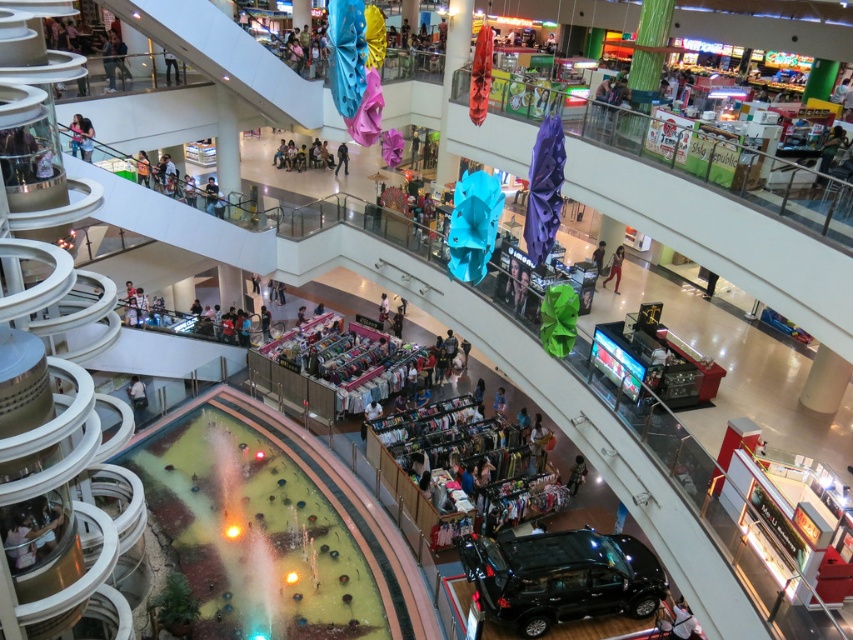
You are a shopper standing at the entrance of the mall and see the matte black clothing at center and the white fabric person at lower left. Which object is positioned to the right side from your viewpoint?

The matte black clothing at center is positioned to the right of the white fabric person at lower left.

You are a shopper who wants to take a photo of both the translucent glass fountain at center and the skinny jeans at center from the second level. Can you fit both in your camera frame if the fountain is wider than the jeans?

The translucent glass fountain at center is wider than the skinny jeans at center, so if you position yourself appropriately on the second level, you can likely capture both in your camera frame as long as the distance allows the fountain and jeans to fit within the viewfinder.